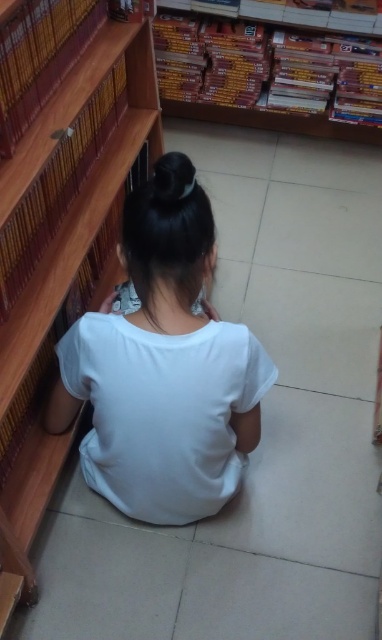
You are standing in the bookstore and want to reach the wooden bookshelf at upper center. There is a wooden bookshelf at left blocking your path. Can you walk around it to get to the upper center shelf?

The wooden bookshelf at left is closer to you than the wooden bookshelf at upper center, so you can walk around it to reach the upper center shelf.